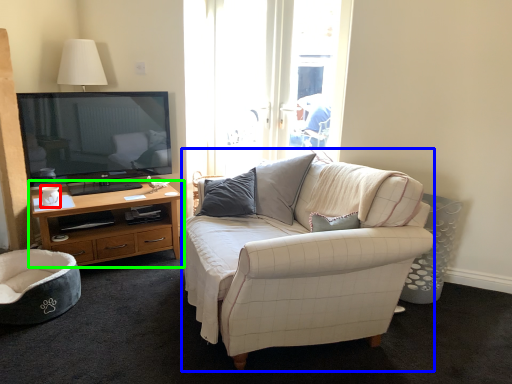
Question: Considering the real-world distances, which object is farthest from coffee cup (highlighted by a red box)? studio couch (highlighted by a blue box) or cabinetry (highlighted by a green box)?

Choices:
 (A) studio couch
 (B) cabinetry

Answer: (A)